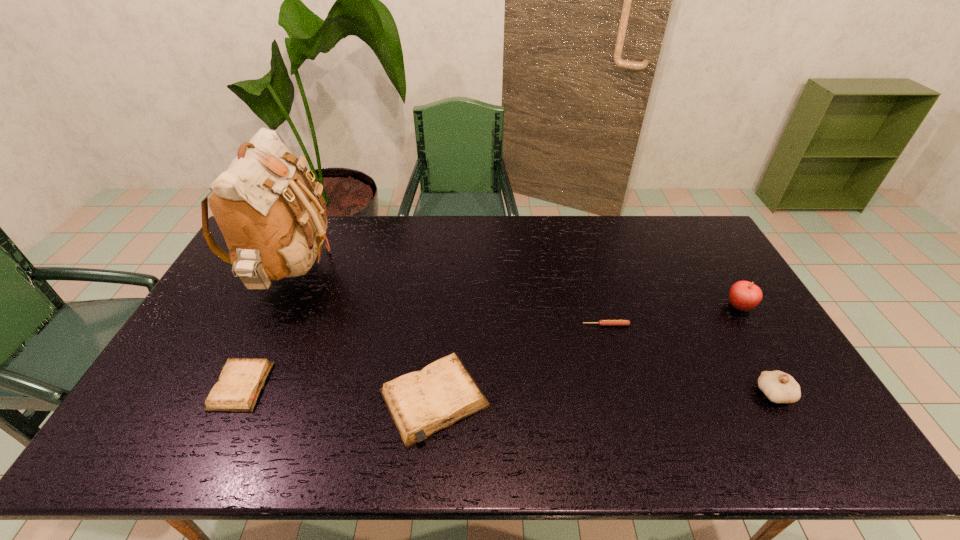
Identify the location of free space located 0.370m on the left of the fourth object from right to left. The height and width of the screenshot is (540, 960). [233, 399].

Identify the location of free spot located on the front-facing side of the backpack. (442, 273).

Where is `vacant position located on the front of the apple`? vacant position located on the front of the apple is located at coordinates (788, 387).

I want to click on vacant space located 0.160m on the left of the third object from right to left, so click(529, 325).

Locate an element on the screen. Image resolution: width=960 pixels, height=540 pixels. free spot located on the back of the garlic is located at coordinates pyautogui.click(x=739, y=333).

At what (x,y) coordinates should I click in order to perform the action: click on object that is at the far edge. Please return your answer as a coordinate pair (x, y). The height and width of the screenshot is (540, 960). Looking at the image, I should click on tap(273, 225).

Identify the location of garlic that is positioned at the near edge. The width and height of the screenshot is (960, 540). (779, 387).

At what (x,y) coordinates should I click in order to perform the action: click on diary present at the left edge. Please return your answer as a coordinate pair (x, y). The width and height of the screenshot is (960, 540). Looking at the image, I should click on (240, 383).

This screenshot has height=540, width=960. I want to click on backpack that is positioned at the left edge, so click(273, 225).

This screenshot has height=540, width=960. What are the coordinates of `apple present at the right edge` in the screenshot? It's located at (743, 295).